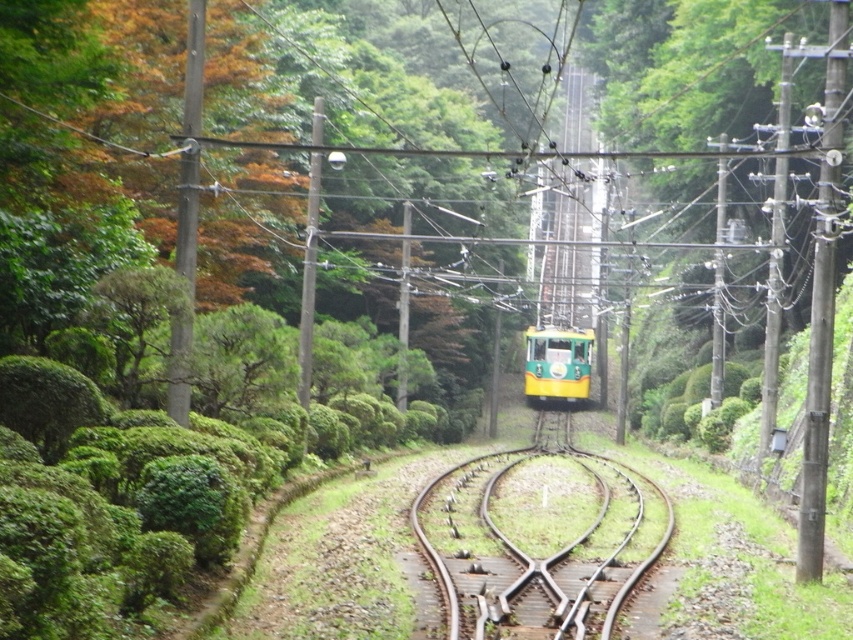
You are a passenger on the green matte train at center and want to know if you can see the entire length of the brown wooden train track at center from your current position. Can you?

The brown wooden train track at center is shorter than the green matte train at center. Therefore, you cannot see the entire length of the brown wooden train track at center from your current position because the train is longer than the track.

You are a photographer positioned at the start of the brown wooden train track at center. You want to take a photo of the green matte train at center. Which object is closer to you so that you can focus on it first?

The brown wooden train track at center is closer to the viewer than the green matte train at center, so you should focus on the brown wooden train track at center first before the green matte train at center.

You are standing at the point closer to the viewer between point (427,524) and point (556,356). Which point are you at?

You are at point (427,524) because it is closer to the viewer than point (556,356).